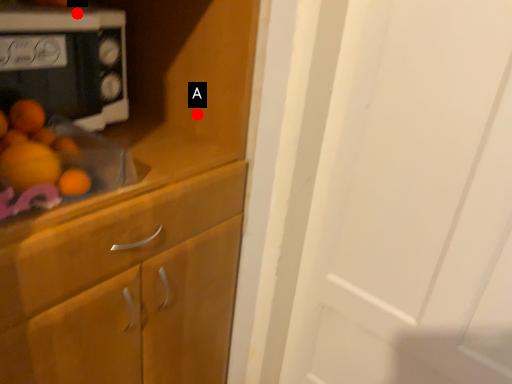
Question: Two points are circled on the image, labeled by A and B beside each circle. Which point is farther to the camera?

Choices:
 (A) A is further
 (B) B is further

Answer: (A)